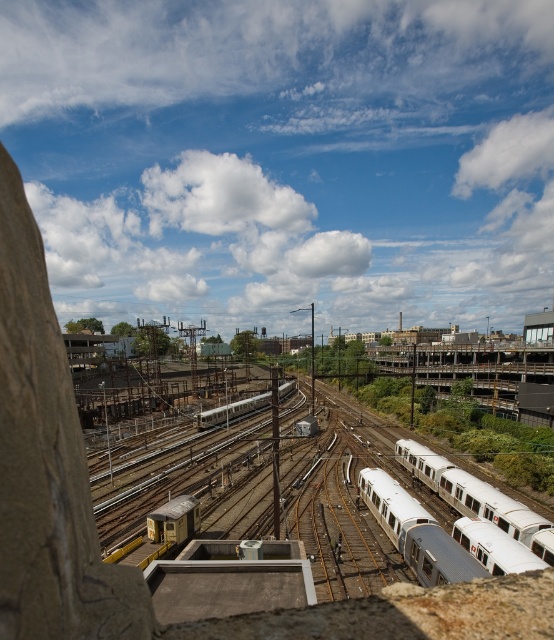
Question: Which object appears closest to the camera in this image?

Choices:
 (A) white glossy train at center
 (B) silver metallic train at right

Answer: (B)

Question: Is silver metallic train at right wider than white glossy train at center?

Choices:
 (A) no
 (B) yes

Answer: (A)

Question: Is silver metallic train at right thinner than white glossy train at center?

Choices:
 (A) yes
 (B) no

Answer: (A)

Question: Which point appears farthest from the camera in this image?

Choices:
 (A) (233, 404)
 (B) (439, 467)

Answer: (A)

Question: Is silver metallic train at right below white glossy train at center?

Choices:
 (A) yes
 (B) no

Answer: (B)

Question: Which object appears closest to the camera in this image?

Choices:
 (A) silver metallic train at right
 (B) white glossy train at center

Answer: (A)